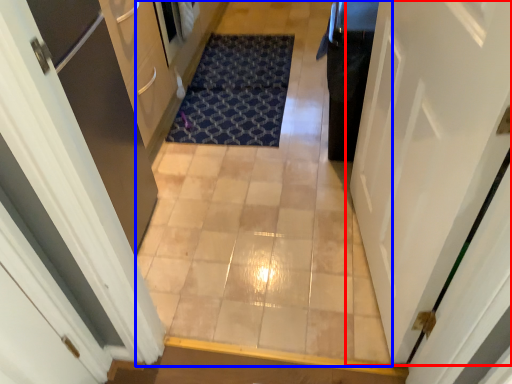
Question: Which point is closer to the camera, door (highlighted by a red box) or corridor (highlighted by a blue box)?

Choices:
 (A) door
 (B) corridor

Answer: (A)